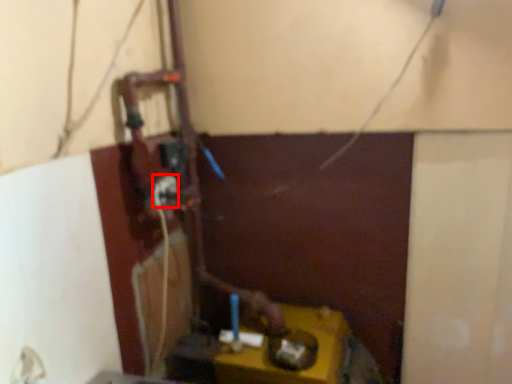
Question: From the image, what is the correct spatial relationship of power plugs and sockets (annotated by the red box) in relation to table?

Choices:
 (A) left
 (B) right

Answer: (A)